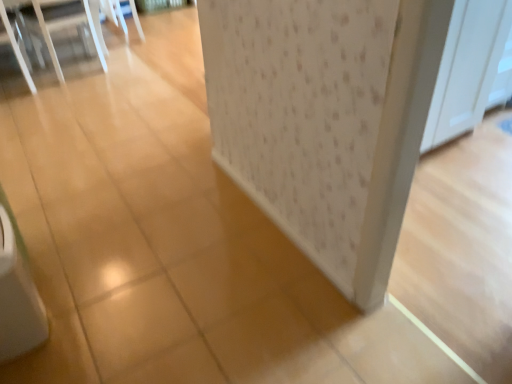
Question: Is white wood screen door at upper right inside or outside of clear plastic chairs at upper left?

Choices:
 (A) inside
 (B) outside

Answer: (B)

Question: Visually, is white wood screen door at upper right positioned to the left or to the right of clear plastic chairs at upper left?

Choices:
 (A) right
 (B) left

Answer: (A)

Question: From the image's perspective, is white wood screen door at upper right positioned above or below clear plastic chairs at upper left?

Choices:
 (A) below
 (B) above

Answer: (A)

Question: Considering the positions of clear plastic chairs at upper left and white wood screen door at upper right in the image, is clear plastic chairs at upper left bigger or smaller than white wood screen door at upper right?

Choices:
 (A) small
 (B) big

Answer: (B)

Question: Is clear plastic chairs at upper left taller or shorter than white wood screen door at upper right?

Choices:
 (A) short
 (B) tall

Answer: (A)

Question: Considering the positions of clear plastic chairs at upper left and white wood screen door at upper right in the image, is clear plastic chairs at upper left wider or thinner than white wood screen door at upper right?

Choices:
 (A) wide
 (B) thin

Answer: (A)

Question: From the image's perspective, is clear plastic chairs at upper left above or below white wood screen door at upper right?

Choices:
 (A) below
 (B) above

Answer: (B)